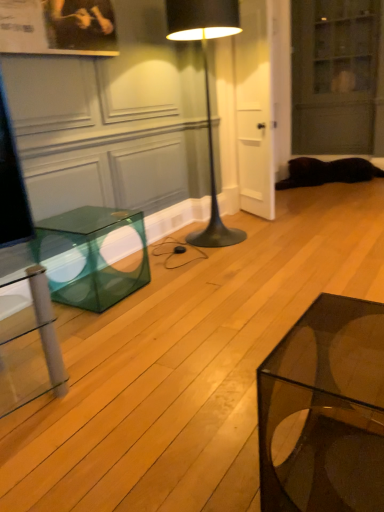
Locate an element on the screen. Image resolution: width=384 pixels, height=512 pixels. vacant area that lies between transparent glass coffee table at lower right and transparent glass cube at left is located at coordinates (190, 367).